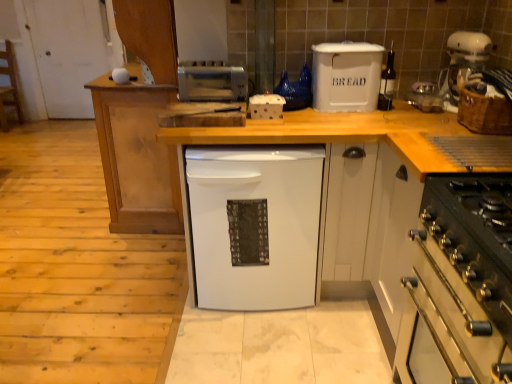
Where is `vacant space that is in between white plastic bread bin at upper center and woven brown basket at right`? This screenshot has height=384, width=512. vacant space that is in between white plastic bread bin at upper center and woven brown basket at right is located at coordinates (400, 120).